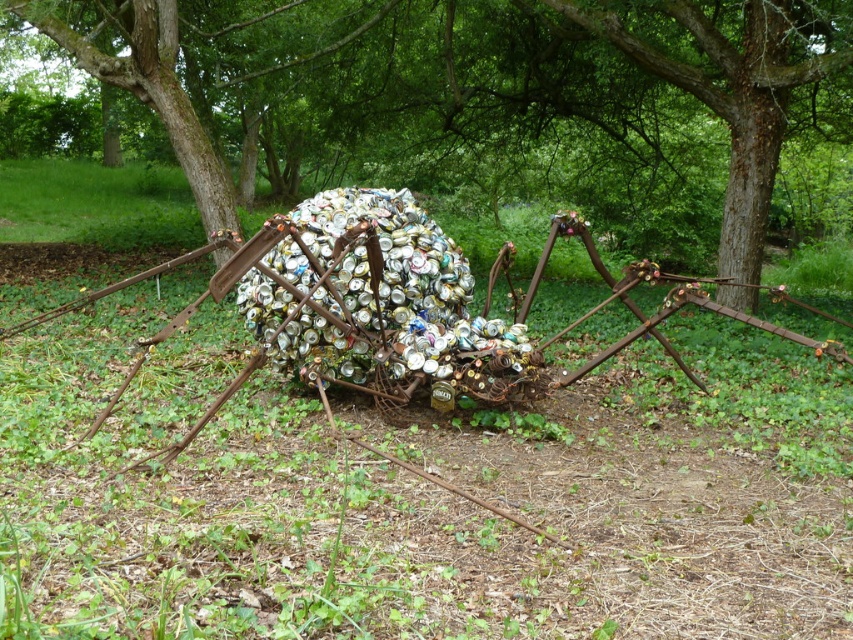
Who is lower down, brown wood tree at center or rusty metal spider at center?

rusty metal spider at center is lower down.

Can you confirm if brown wood tree at center is taller than rusty metal spider at center?

Yes.

Looking at this image, who is more distant from viewer, (111, 26) or (508, 380)?

Positioned behind is point (111, 26).

Locate an element on the screen. brown wood tree at center is located at coordinates (489, 99).